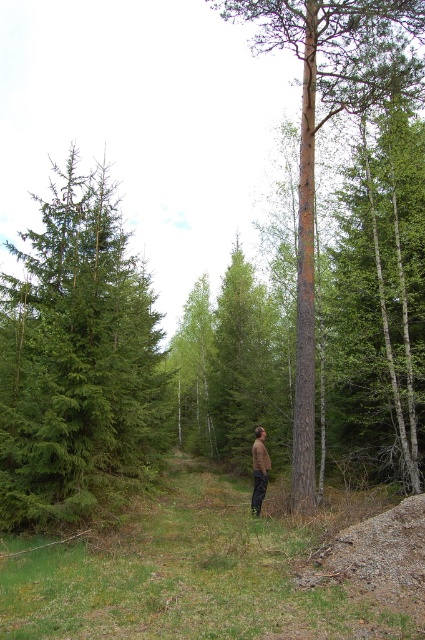
You are a hiker standing at point (320, 125) in the forest. You see a brown rough bark tree at center. Which direction should you walk to reach the tree trunk on the right side of the frame?

The brown rough bark tree at center is located at point (320, 125). To reach the tree trunk on the right side of the frame, you should walk towards the right from your current position.